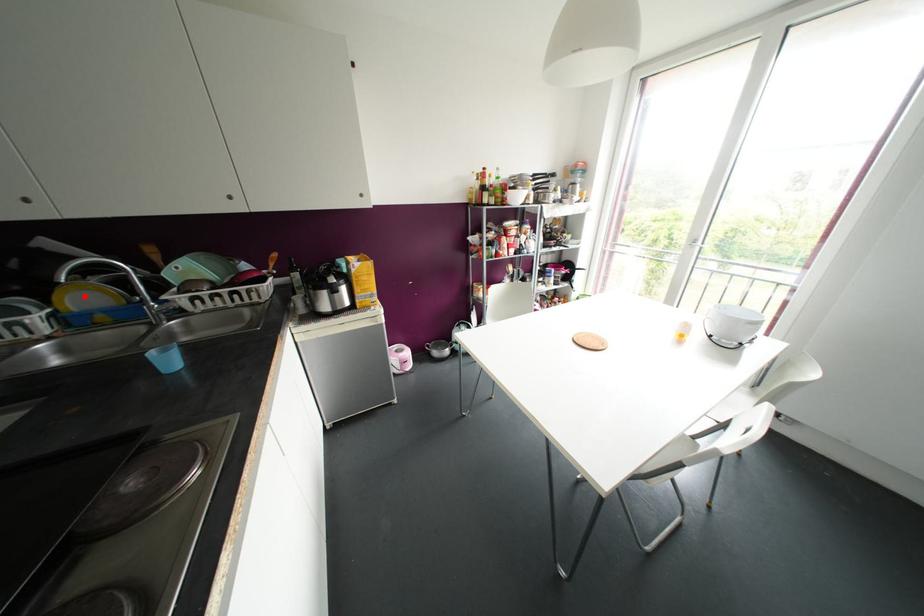
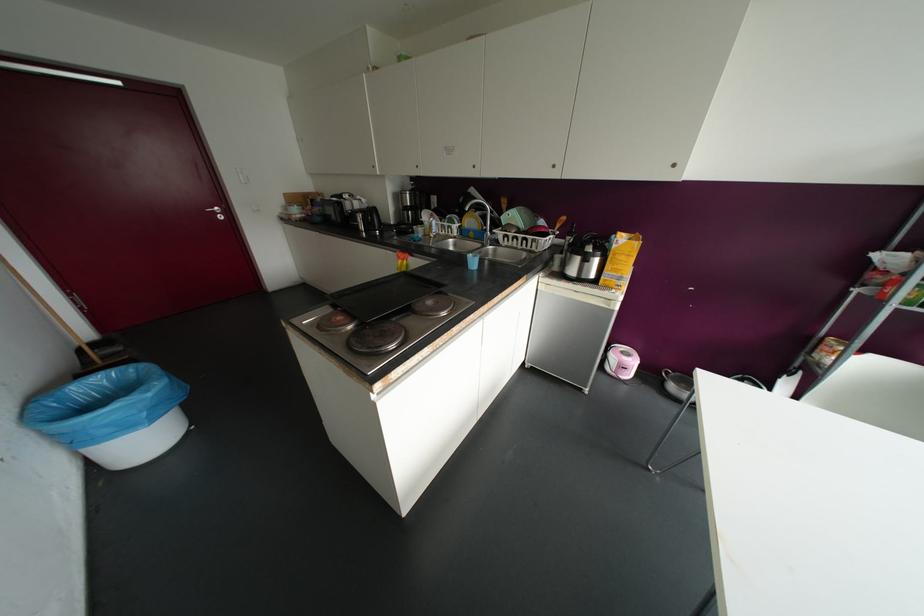
Question: I am providing you with two images of the same scene from different viewpoints. Image1 has a red point marked. In image2, the corresponding 3D location appears at what relative position? Reply with the corresponding letter.

Choices:
 (A) Closer
 (B) Farther

Answer: (A)